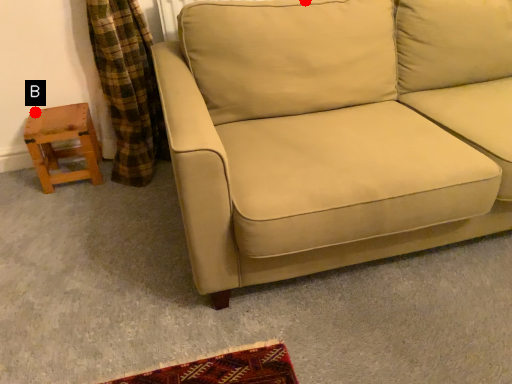
Question: Two points are circled on the image, labeled by A and B beside each circle. Which point is closer to the camera?

Choices:
 (A) A is closer
 (B) B is closer

Answer: (A)